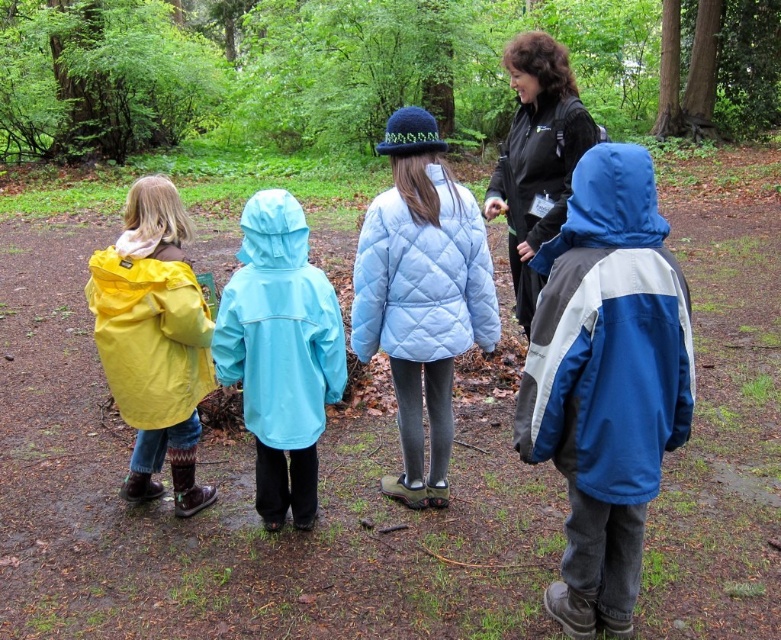
Question: Based on their relative distances, which object is farther from the yellow waterproof jacket at left?

Choices:
 (A) black matte jacket at upper center
 (B) blue/gray/white jacket at right

Answer: (A)

Question: Considering the real-world distances, which object is farthest from the black matte jacket at upper center?

Choices:
 (A) light blue quilted jacket at center
 (B) green leafy forest at upper center
 (C) yellow waterproof jacket at left
 (D) blue/gray/white jacket at right

Answer: (B)

Question: Which object is farther from the camera taking this photo?

Choices:
 (A) green leafy forest at upper center
 (B) black matte jacket at upper center
 (C) light blue waterproof jacket at center
 (D) light blue quilted jacket at center

Answer: (A)

Question: Does light blue quilted jacket at center appear on the left side of black matte jacket at upper center?

Choices:
 (A) no
 (B) yes

Answer: (B)

Question: Where is green leafy forest at upper center located in relation to blue/gray/white jacket at right in the image?

Choices:
 (A) below
 (B) above

Answer: (B)

Question: Can you confirm if green leafy forest at upper center is smaller than light blue quilted jacket at center?

Choices:
 (A) no
 (B) yes

Answer: (A)